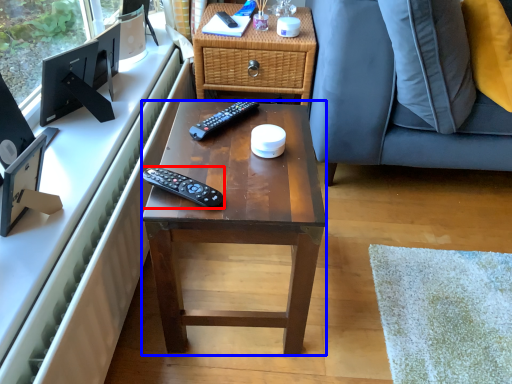
Question: Which of the following is the closest to the observer, remote control (highlighted by a red box) or desk (highlighted by a blue box)?

Choices:
 (A) remote control
 (B) desk

Answer: (B)